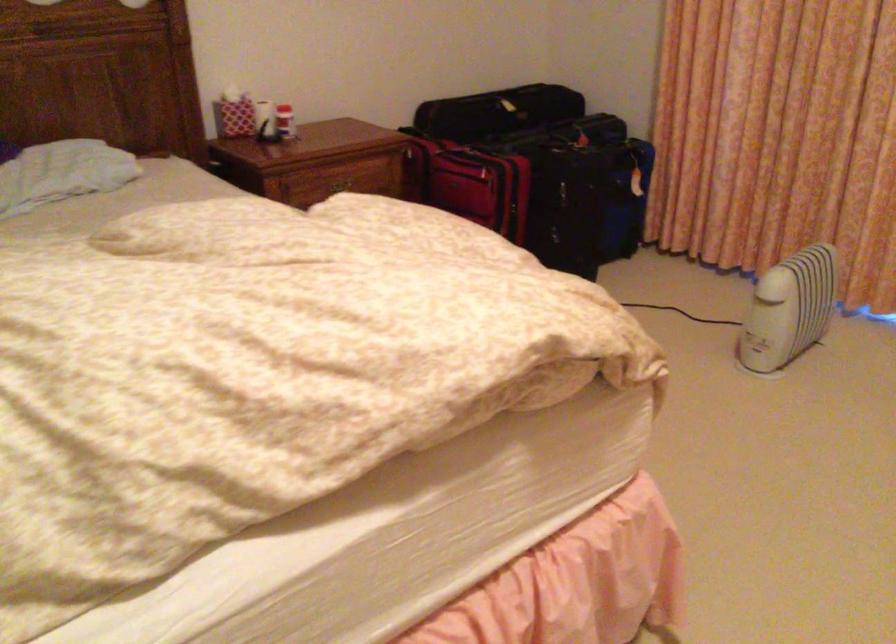
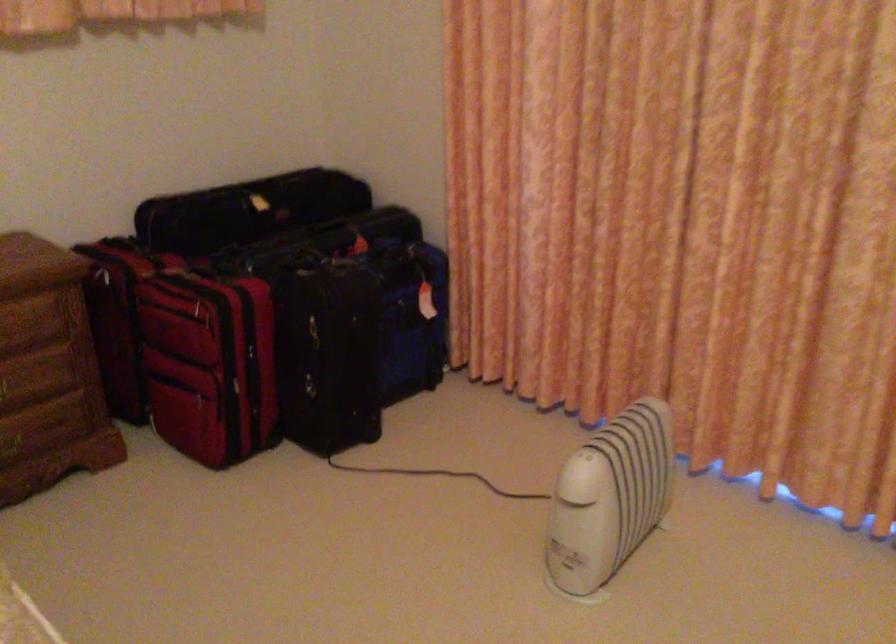
In a continuous first-person perspective shot, in which direction is the camera moving?

The cameraman walked toward right, forward.